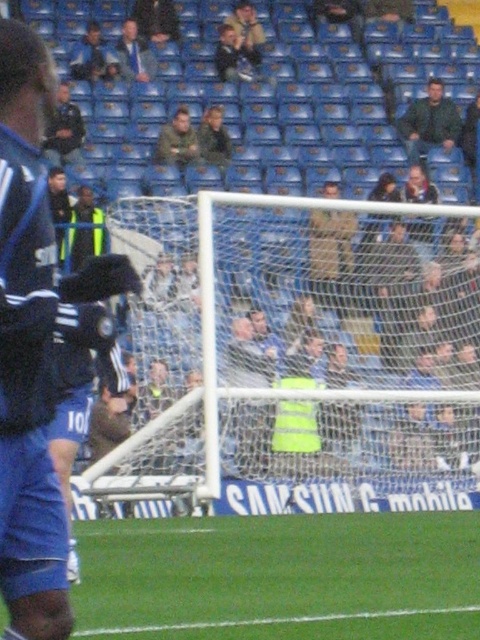
Between point (35, 406) and point (115, 68), which one is positioned behind?

Positioned behind is point (115, 68).

Looking at this image, does blue jersey at left appear over blue jersey at upper left?

Actually, blue jersey at left is below blue jersey at upper left.

The height and width of the screenshot is (640, 480). What are the coordinates of `blue jersey at left` in the screenshot? It's located at (36, 342).

I want to click on blue jersey at left, so click(36, 342).

Between green matte jacket at upper right and camouflage jacket at center, which one appears on the left side from the viewer's perspective?

Positioned to the left is camouflage jacket at center.

Is point (432, 88) in front of point (190, 156)?

No.

You are a GUI agent. You are given a task and a screenshot of the screen. Output one action in this format:
    pyautogui.click(x=<x>, y=<y>)
    Task: Click on the green matte jacket at upper right
    
    Given the screenshot: What is the action you would take?
    pyautogui.click(x=430, y=122)

Is blue jersey at left positioned behind green matte jacket at upper right?

No, blue jersey at left is closer to the viewer.

Which is in front, point (29, 106) or point (433, 108)?

Point (29, 106) is more forward.

You are a GUI agent. You are given a task and a screenshot of the screen. Output one action in this format:
    pyautogui.click(x=<x>, y=<y>)
    Task: Click on the blue jersey at left
    
    Given the screenshot: What is the action you would take?
    pyautogui.click(x=36, y=342)